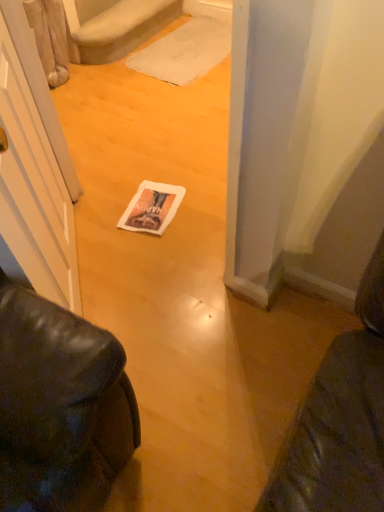
This screenshot has height=512, width=384. Identify the location of vacant area on top of white paper magazine at center (from a real-world perspective). (152, 205).